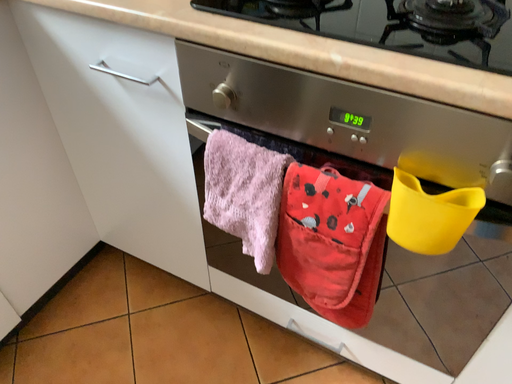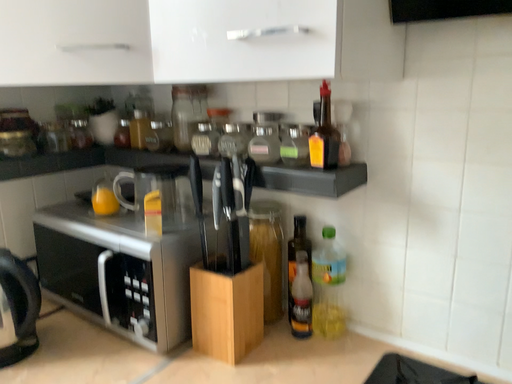
Question: Which way did the camera rotate in the video?

Choices:
 (A) rotated downward
 (B) rotated upward

Answer: (B)